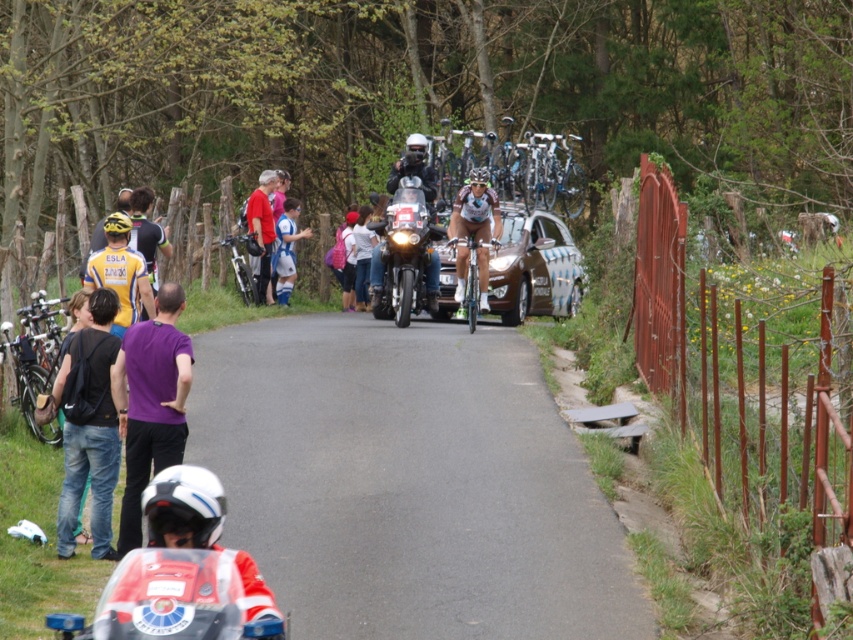
Question: Can you confirm if rusty metal fence at right is positioned to the left of shiny blue cycling suit at center?

Choices:
 (A) no
 (B) yes

Answer: (A)

Question: Can you confirm if yellow matte jersey at left is bigger than shiny silver bicycle at center?

Choices:
 (A) no
 (B) yes

Answer: (B)

Question: Which point is closer to the camera?

Choices:
 (A) (281, 275)
 (B) (96, 429)
 (C) (380, 308)

Answer: (B)

Question: Does purple matte shirt at center appear on the right side of yellow matte jersey at left?

Choices:
 (A) no
 (B) yes

Answer: (B)

Question: Which of these objects is positioned closest to the rusty metal fence at right?

Choices:
 (A) denim jacket at left
 (B) shiny metallic bicycle at left
 (C) shiny silver bicycle at center
 (D) red glossy motorcycle at lower left

Answer: (A)

Question: Which point is farther to the camera?

Choices:
 (A) blue jersey at center
 (B) shiny black motorcycle at center
 (C) shiny blue cycling suit at center

Answer: (A)